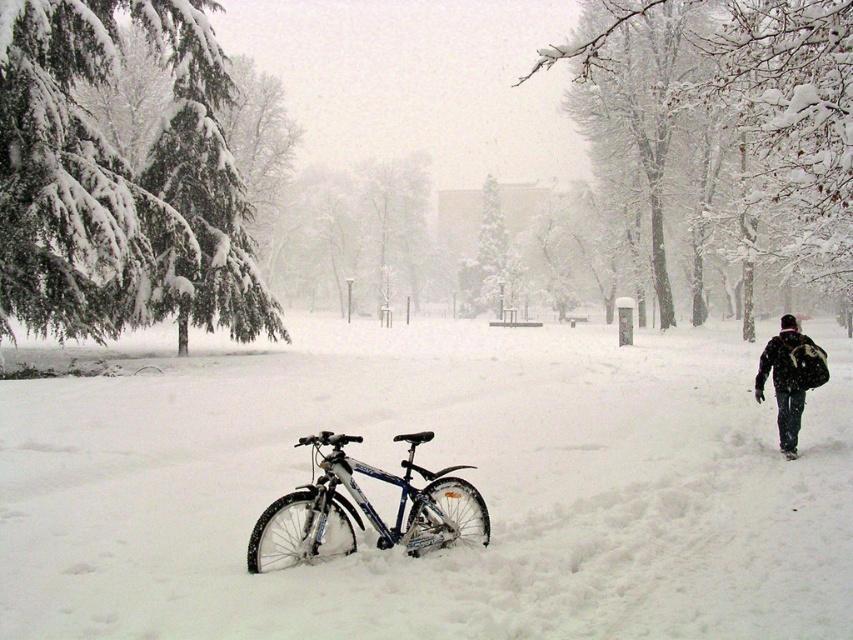
Is snow-covered tree at upper center wider than shiny metallic bicycle at center?

Yes.

Does snow-covered tree at upper center appear over shiny metallic bicycle at center?

Indeed, snow-covered tree at upper center is positioned over shiny metallic bicycle at center.

Is point (815, 152) less distant than point (351, 506)?

No, it is behind (351, 506).

Locate an element on the screen. The image size is (853, 640). snow-covered tree at upper center is located at coordinates (792, 115).

Does snow-covered evergreen at left have a larger size compared to dark blue jeans at lower right?

Yes, snow-covered evergreen at left is bigger than dark blue jeans at lower right.

Which is above, snow-covered evergreen at left or dark blue jeans at lower right?

Positioned higher is snow-covered evergreen at left.

Measure the distance between point (149, 26) and camera.

Point (149, 26) and camera are 21.19 meters apart.

At what (x,y) coordinates should I click in order to perform the action: click on snow-covered evergreen at left. Please return your answer as a coordinate pair (x, y). The width and height of the screenshot is (853, 640). Looking at the image, I should click on (119, 182).

Is point (61, 108) positioned before point (761, 147)?

That is True.

Is snow-covered evergreen at left smaller than snow-covered tree at upper center?

Yes.

Image resolution: width=853 pixels, height=640 pixels. What are the coordinates of `snow-covered evergreen at left` in the screenshot? It's located at (119, 182).